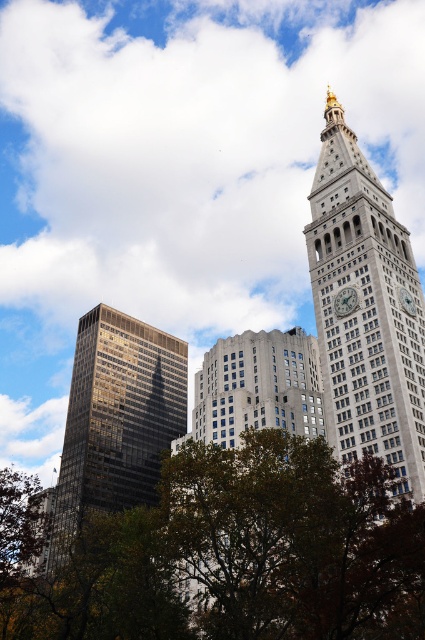
You are a city planner assessing building heights for a new project. Given the scene described, which of the two buildings, the gray stone clock tower at upper right or the reflective glass skyscraper at left, has a greater height?

The gray stone clock tower at upper right is taller than the reflective glass skyscraper at left according to the description.

You are standing in the city square looking at the green leafy tree at lower center and the gray stone clock tower at upper right. Which object is positioned higher in the image?

The gray stone clock tower at upper right is positioned higher in the image than the green leafy tree at lower center.